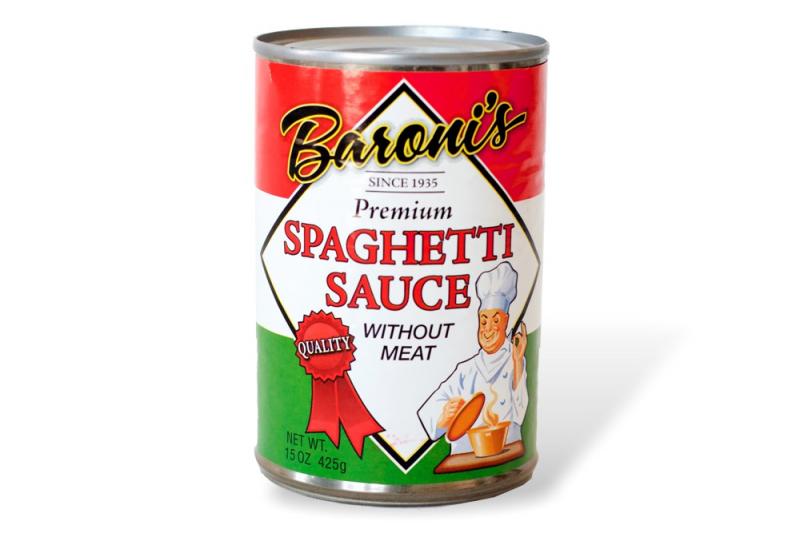
Locate an element on the screen. pan/pot is located at coordinates (501, 431).